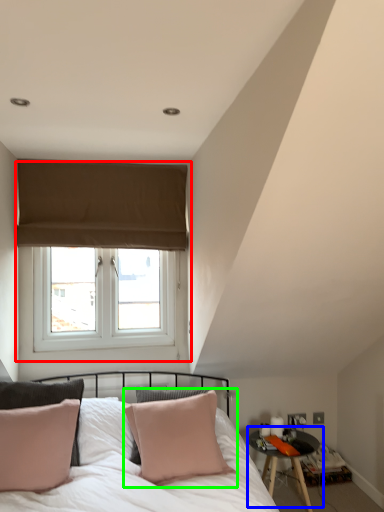
Question: Which is nearer to the window (highlighted by a red box)? table (highlighted by a blue box) or pillow (highlighted by a green box).

Choices:
 (A) table
 (B) pillow

Answer: (B)